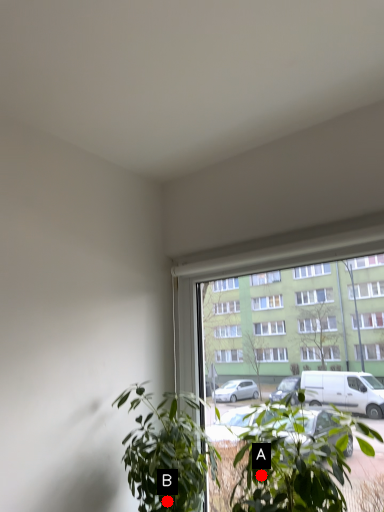
Question: Two points are circled on the image, labeled by A and B beside each circle. Which point is closer to the camera?

Choices:
 (A) A is closer
 (B) B is closer

Answer: (A)